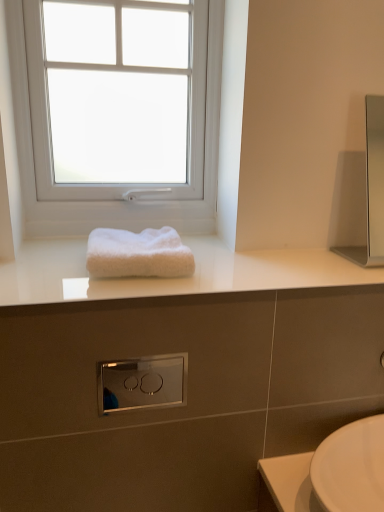
Question: Is satin chrome switch at center to the left or to the right of satin silver medicine cabinet at right in the image?

Choices:
 (A) right
 (B) left

Answer: (B)

Question: From a real-world perspective, is satin chrome switch at center physically located above or below satin silver medicine cabinet at right?

Choices:
 (A) below
 (B) above

Answer: (A)

Question: Which object is positioned farthest from the white plastic window at upper center?

Choices:
 (A) satin chrome switch at center
 (B) satin silver medicine cabinet at right
 (C) white glossy towel at center
 (D) white fluffy towel at center

Answer: (A)

Question: Based on their relative distances, which object is nearer to the white glossy towel at center?

Choices:
 (A) satin silver medicine cabinet at right
 (B) white fluffy towel at center
 (C) white plastic window at upper center
 (D) satin chrome switch at center

Answer: (B)